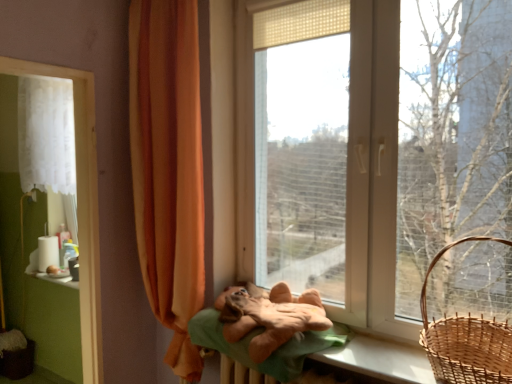
Question: From the image's perspective, is orange fabric curtain at left, the 1th curtain from the right, above or below white fabric at left?

Choices:
 (A) below
 (B) above

Answer: (B)

Question: Is orange fabric curtain at left, the 1th curtain from the right, taller or shorter than white fabric at left?

Choices:
 (A) short
 (B) tall

Answer: (B)

Question: Based on their relative distances, which object is nearer to the soft brown plush at center?

Choices:
 (A) white sheer curtain at left, which appears as the first curtain when viewed from the back
 (B) woven brown basket at right
 (C) transparent plastic window at center
 (D) white fabric at left
 (E) orange fabric curtain at left, the 1th curtain from the right

Answer: (C)

Question: Estimate the real-world distances between objects in this image. Which object is closer to the soft brown plush at center?

Choices:
 (A) woven brown basket at right
 (B) transparent plastic window at center
 (C) white fabric at left
 (D) brown woven basket at lower left
 (E) orange fabric curtain at left, the 1th curtain from the right

Answer: (B)